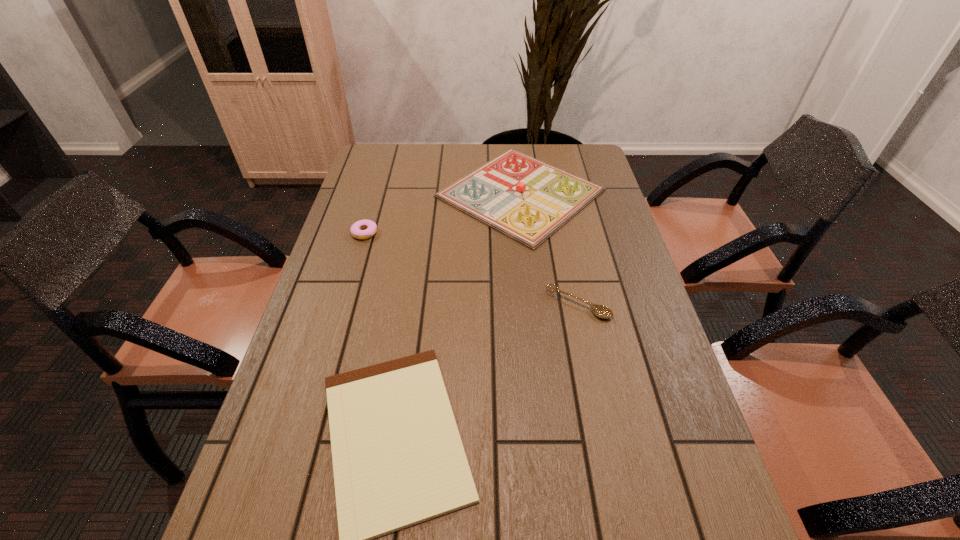
Find the location of a particular element. The width and height of the screenshot is (960, 540). gameboard is located at coordinates (528, 200).

What are the coordinates of `the second tallest object` in the screenshot? It's located at (370, 227).

Locate an element on the screen. Image resolution: width=960 pixels, height=540 pixels. ladle is located at coordinates [x=601, y=311].

The height and width of the screenshot is (540, 960). Identify the location of the second shortest object. (601, 311).

Identify the location of free space located 0.180m on the front of the gameboard. This screenshot has height=540, width=960. (532, 295).

What are the coordinates of `vacant region located on the right of the third shortest object` in the screenshot? It's located at (500, 233).

Locate an element on the screen. free space located 0.150m on the front of the ladle is located at coordinates (592, 372).

Locate an element on the screen. This screenshot has width=960, height=540. object at the far edge is located at coordinates (528, 200).

Where is `object that is at the left edge`? The width and height of the screenshot is (960, 540). object that is at the left edge is located at coordinates (370, 227).

Find the location of `gameboard that is at the right edge`. gameboard that is at the right edge is located at coordinates (528, 200).